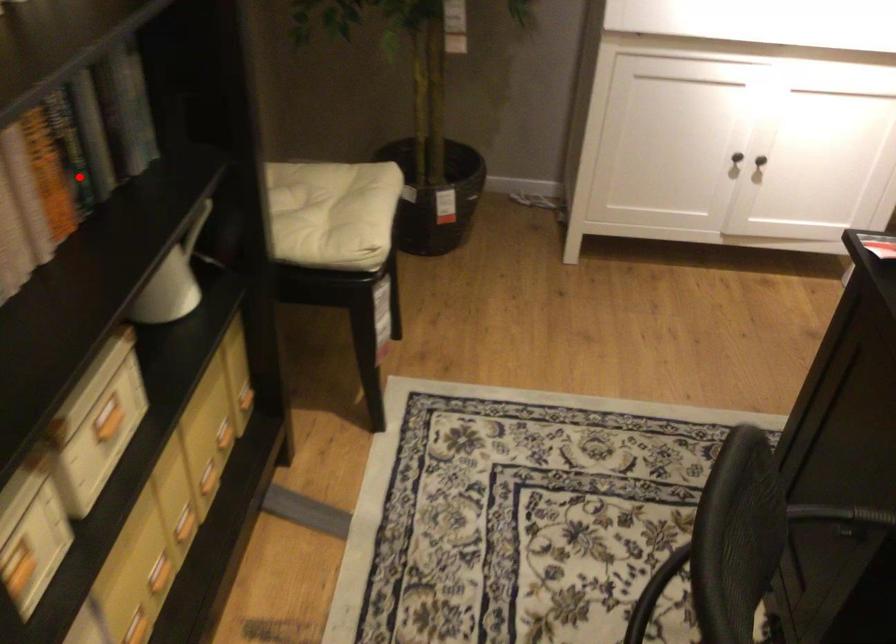
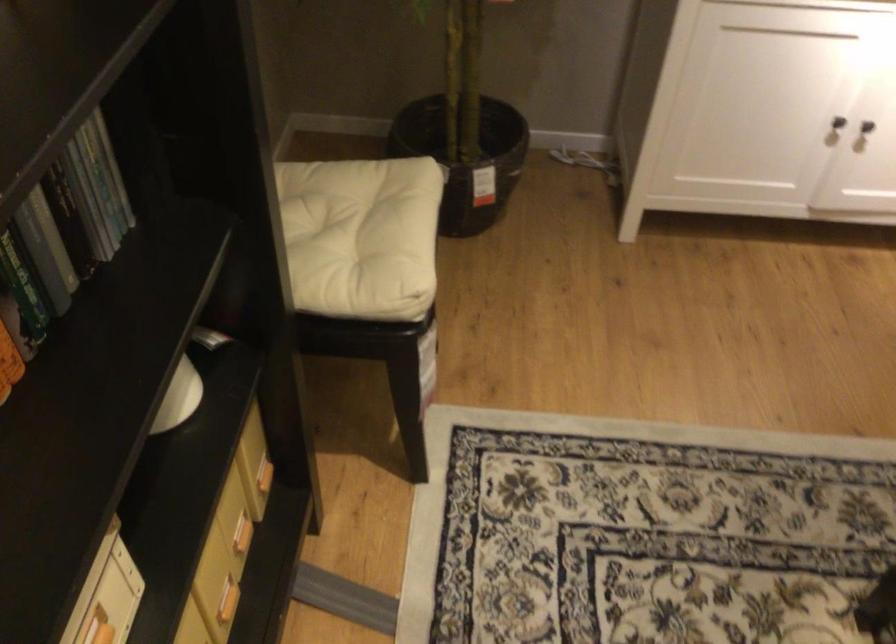
In the second image, find the point that corresponds to the highlighted location in the first image.

(22, 288)